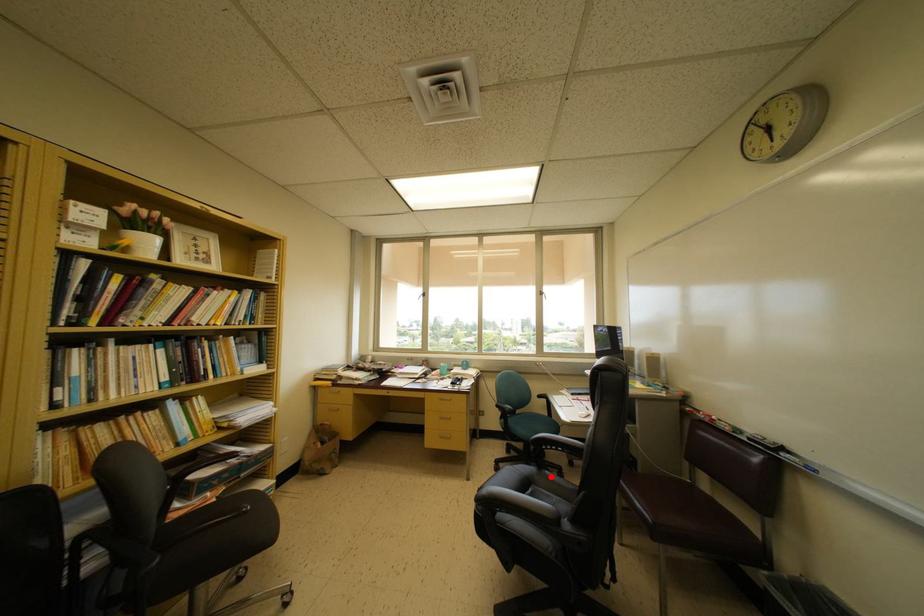
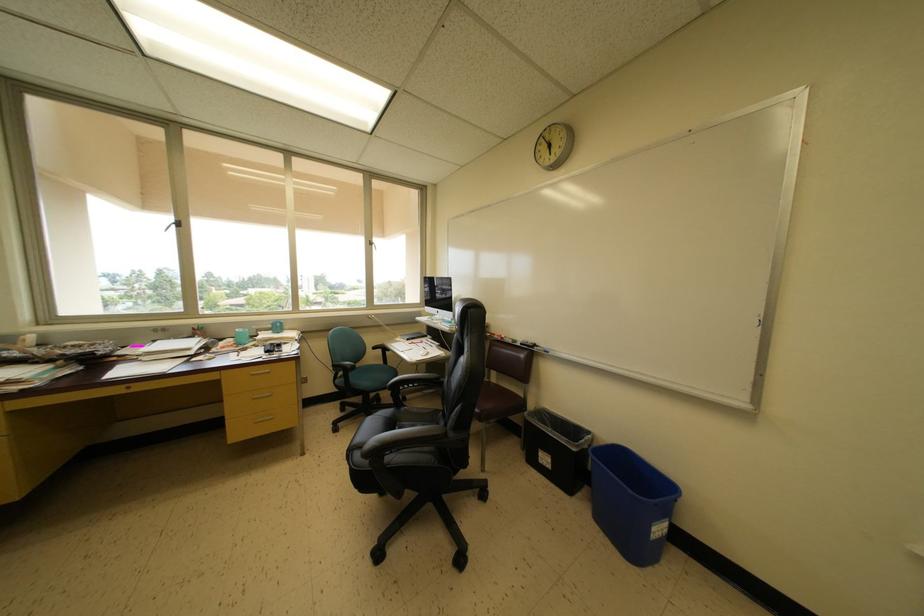
Locate, in the second image, the point that corresponds to the highlighted location in the first image.

(408, 413)